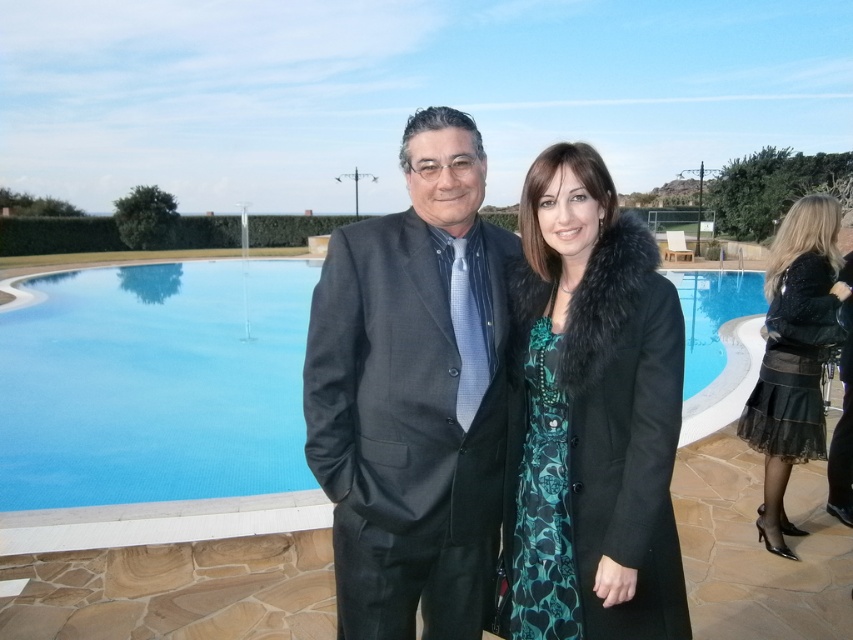
Can you confirm if black fur-trimmed coat at center is smaller than black lace skirt at lower right?

Actually, black fur-trimmed coat at center might be larger than black lace skirt at lower right.

Can you confirm if black fur-trimmed coat at center is positioned to the left of black lace skirt at lower right?

Indeed, black fur-trimmed coat at center is positioned on the left side of black lace skirt at lower right.

At what (x,y) coordinates should I click in order to perform the action: click on black fur-trimmed coat at center. Please return your answer as a coordinate pair (x, y). This screenshot has width=853, height=640. Looking at the image, I should click on pos(592,416).

Based on the photo, can you confirm if matte black suit at center is positioned to the right of black fur-trimmed coat at center?

Incorrect, matte black suit at center is not on the right side of black fur-trimmed coat at center.

Can you confirm if matte black suit at center is shorter than black fur-trimmed coat at center?

Incorrect, matte black suit at center's height does not fall short of black fur-trimmed coat at center's.

Which is in front, point (398, 349) or point (662, 352)?

Positioned in front is point (662, 352).

Find the location of a particular element. Image resolution: width=853 pixels, height=640 pixels. matte black suit at center is located at coordinates (413, 394).

In the scene shown: Between matte black suit at center and black lace skirt at lower right, which one is positioned lower?

matte black suit at center

Does matte black suit at center have a lesser height compared to black lace skirt at lower right?

Incorrect, matte black suit at center's height does not fall short of black lace skirt at lower right's.

Is point (344, 352) closer to viewer compared to point (842, 333)?

Yes, it is in front of point (842, 333).

Locate an element on the screen. The image size is (853, 640). matte black suit at center is located at coordinates (413, 394).